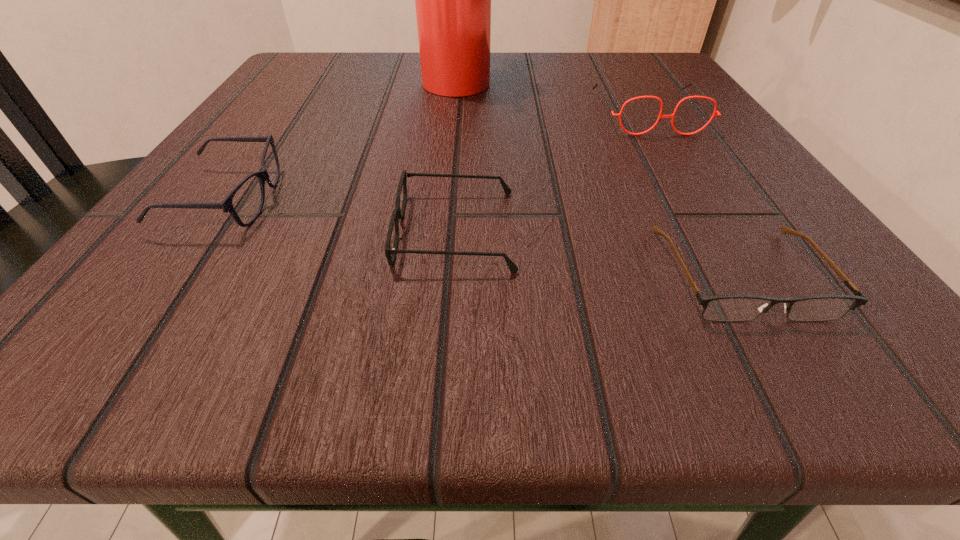
In the image, there is a desktop. Identify the location of free region at the left edge. (328, 152).

The width and height of the screenshot is (960, 540). In order to click on vacant space at the right edge of the desktop in this screenshot , I will do `click(723, 265)`.

Where is `blank space at the far left corner`? This screenshot has width=960, height=540. blank space at the far left corner is located at coordinates (325, 69).

In the image, there is a desktop. Where is `blank space at the far right corner`? blank space at the far right corner is located at coordinates (647, 67).

The width and height of the screenshot is (960, 540). In order to click on vacant point at the near right corner in this screenshot , I will do `click(769, 367)`.

Image resolution: width=960 pixels, height=540 pixels. Identify the location of empty location between the third tallest object and the tallest spectacles. (438, 157).

The image size is (960, 540). Identify the location of free space that is in between the farthest spectacles and the second spectacles from left to right. (552, 172).

You are a GUI agent. You are given a task and a screenshot of the screen. Output one action in this format:
    pyautogui.click(x=<x>, y=<y>)
    Task: Click on the vacant area that lies between the second spectacles from left to right and the leftmost spectacles
    This screenshot has width=960, height=540.
    Given the screenshot: What is the action you would take?
    pyautogui.click(x=342, y=215)

Where is `free area in between the fourth shortest object and the second spectacles from left to right`? Image resolution: width=960 pixels, height=540 pixels. free area in between the fourth shortest object and the second spectacles from left to right is located at coordinates (552, 172).

Find the location of a particular element. unoccupied area between the second tallest object and the tallest object is located at coordinates (553, 96).